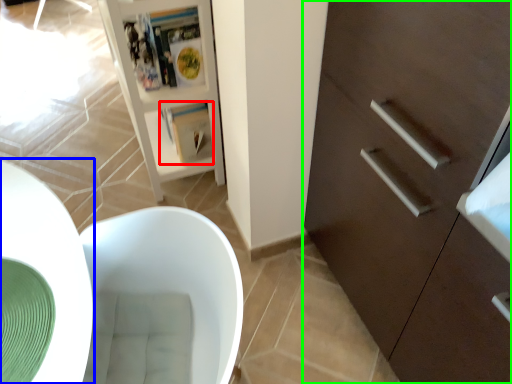
Question: Which object is the closest to the magazine (highlighted by a red box)? Choose among these: round table (highlighted by a blue box) or cabinetry (highlighted by a green box).

Choices:
 (A) round table
 (B) cabinetry

Answer: (A)